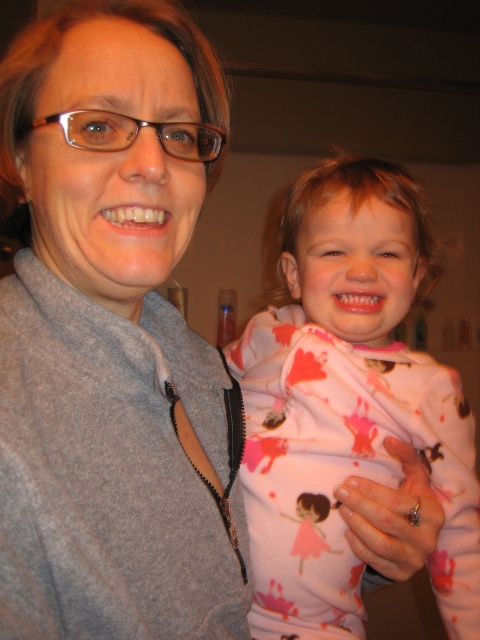
Looking at this image, you are a photographer trying to capture a candid shot of both the gray fleece jacket at left and the pink fleece pajamas at right. Since the background is out of focus, you need to adjust your camera to ensure both subjects are in focus. Which subject should you focus on first to ensure the other is also in focus?

You should focus on the gray fleece jacket at left first because it is positioned closer to the camera than the pink fleece pajamas at right. By focusing on the closer subject, the depth of field will extend backward, potentially keeping both in focus.

Based on the scene description, which object is shorter in height between the gray fleece jacket at left and the pink fleece pajamas at right?

The gray fleece jacket at left is shorter in height compared to the pink fleece pajamas at right.